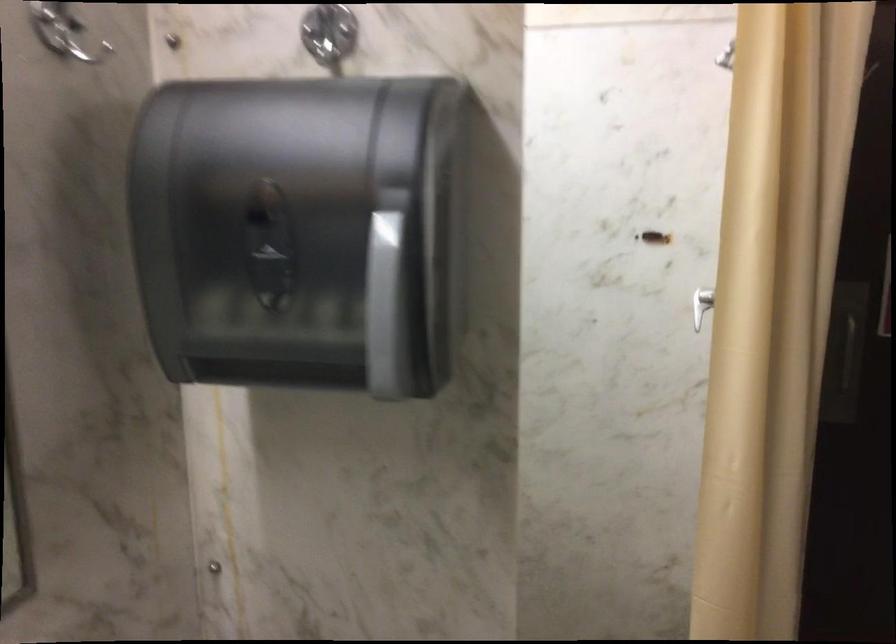
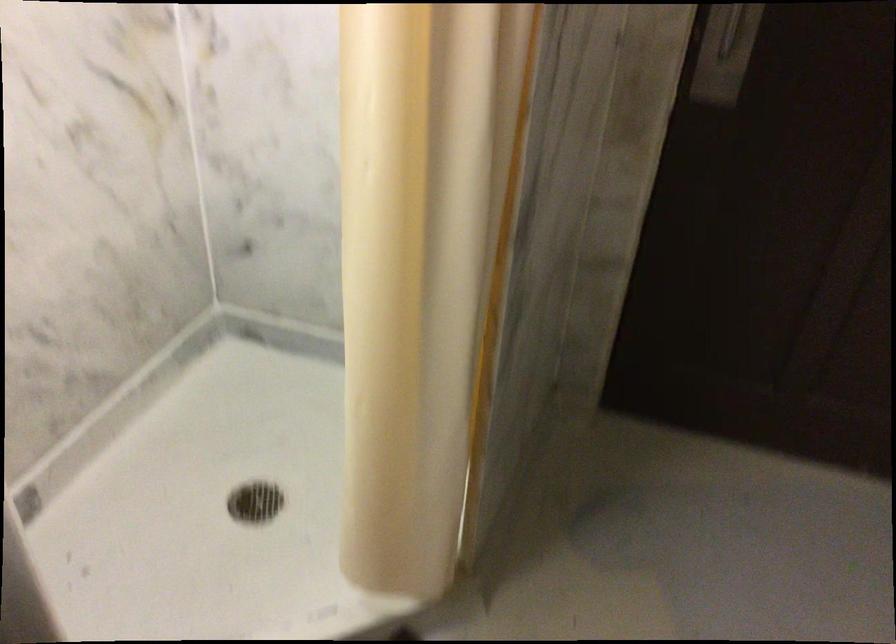
Question: The first image is from the beginning of the video and the second image is from the end. How did the camera likely rotate when shooting the video?

Choices:
 (A) Left
 (B) Right
 (C) Up
 (D) Down

Answer: (D)